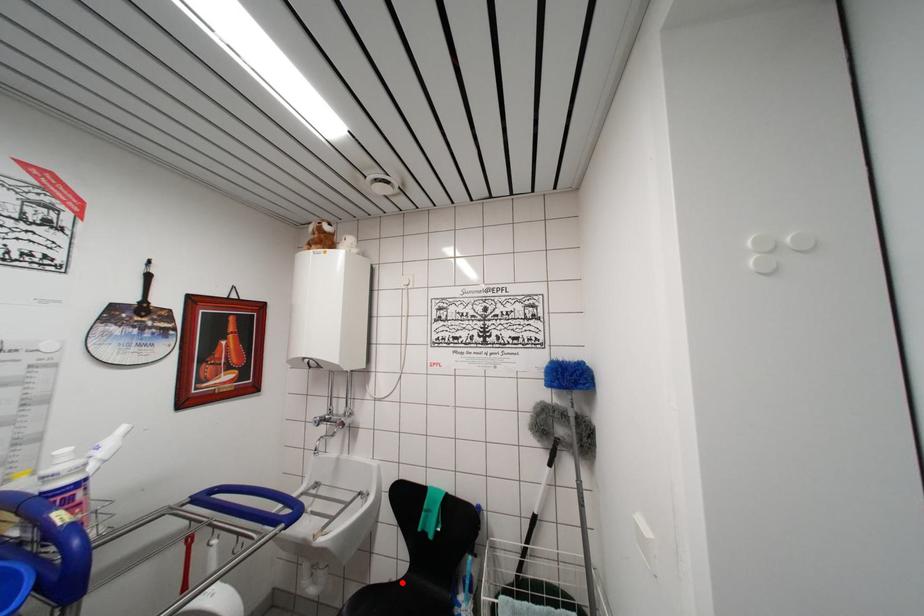
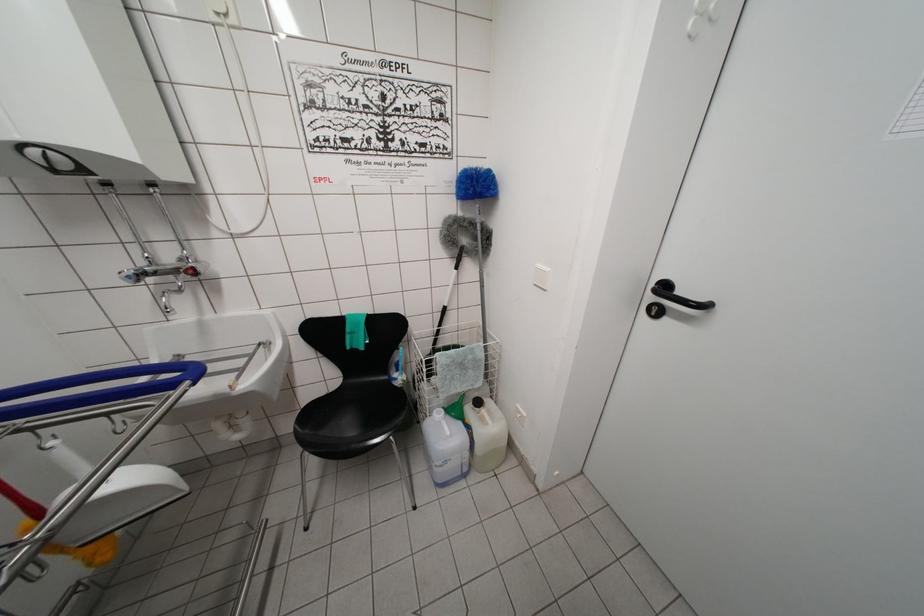
The point at the highlighted location is marked in the first image. Where is the corresponding point in the second image?

(335, 395)